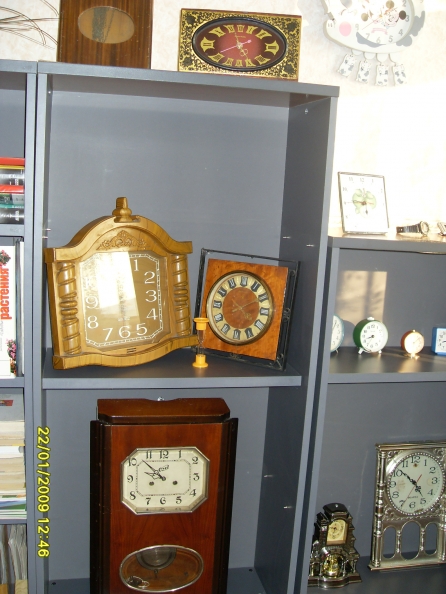
Find the location of `alarm clocks on top shelf of right bookcase`. alarm clocks on top shelf of right bookcase is located at coordinates (337, 338), (369, 333), (414, 346), (440, 344).